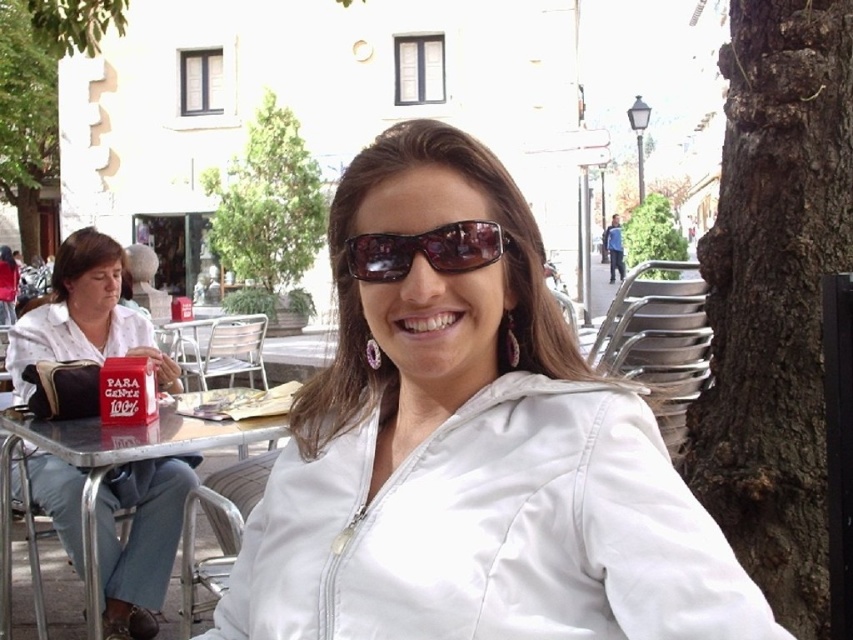
Does sunglasses at center have a greater width compared to green leafy tree at upper center?

No, sunglasses at center is not wider than green leafy tree at upper center.

Is point (457, 266) more distant than point (659, 243)?

No, it is not.

Measure the distance between point (399,236) and camera.

They are 4.50 feet apart.

Identify the location of sunglasses at center. Image resolution: width=853 pixels, height=640 pixels. (426, 250).

Between brown rough bark tree at right and green leafy tree at center, which one has more height?

green leafy tree at center

Consider the image. How far apart are brown rough bark tree at right and green leafy tree at center?

A distance of 13.86 meters exists between brown rough bark tree at right and green leafy tree at center.

Between point (825, 636) and point (231, 184), which one is positioned behind?

Positioned behind is point (231, 184).

Locate an element on the screen. brown rough bark tree at right is located at coordinates (775, 296).

Does brown rough bark tree at right have a greater height compared to sunglasses at center?

Correct, brown rough bark tree at right is much taller as sunglasses at center.

Who is more distant from viewer, (x=845, y=230) or (x=383, y=269)?

The point (x=845, y=230) is behind.

Identify the location of brown rough bark tree at right. This screenshot has width=853, height=640. (x=775, y=296).